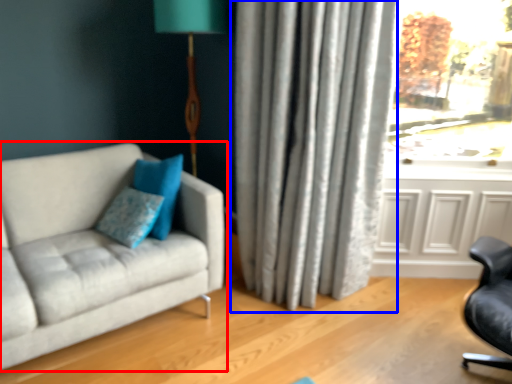
Question: Which of the following is the farthest to the observer, studio couch (highlighted by a red box) or curtain (highlighted by a blue box)?

Choices:
 (A) studio couch
 (B) curtain

Answer: (B)